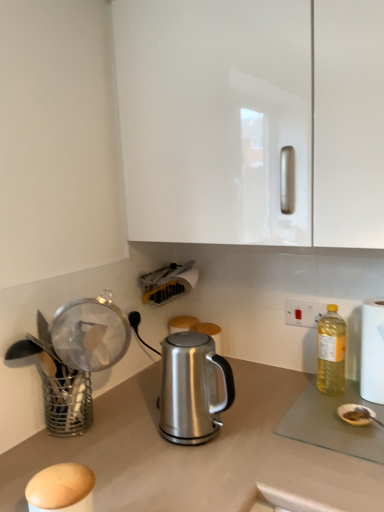
Image resolution: width=384 pixels, height=512 pixels. Identify the location of free space in front of yellow translucent bottle at right. (336, 411).